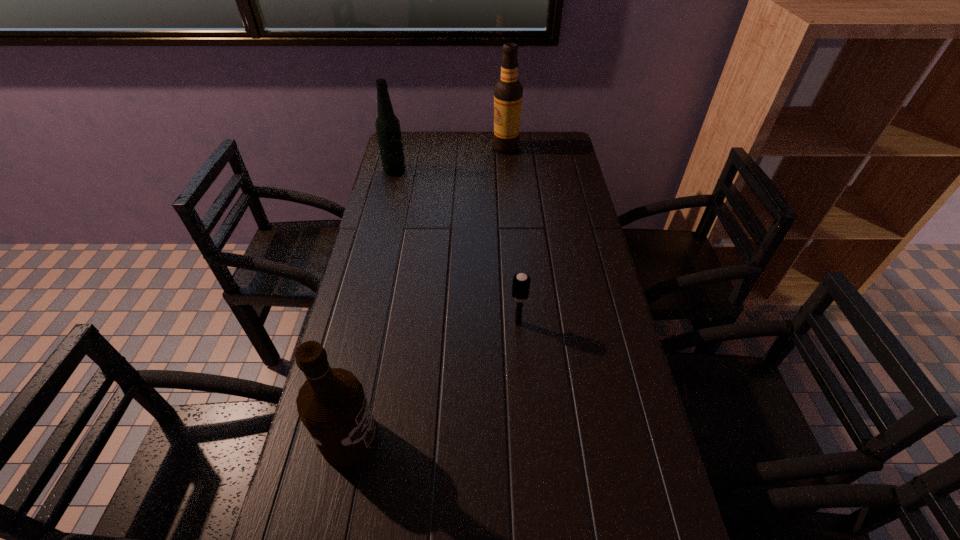
The image size is (960, 540). I want to click on the rightmost alcohol, so click(x=508, y=92).

I want to click on the farthest object, so click(x=508, y=92).

The image size is (960, 540). Find the location of `the third nearest object`. the third nearest object is located at coordinates (387, 125).

Where is `the nearest alcohol`? Image resolution: width=960 pixels, height=540 pixels. the nearest alcohol is located at coordinates (332, 405).

Where is `the shortest object`? The width and height of the screenshot is (960, 540). the shortest object is located at coordinates (521, 282).

Locate an element on the screen. This screenshot has height=540, width=960. hairbrush is located at coordinates tap(521, 282).

Locate an element on the screen. The image size is (960, 540). blank space located on the label of the farthest alcohol is located at coordinates (444, 148).

Where is `free region located on the label of the farthest alcohol`? This screenshot has height=540, width=960. free region located on the label of the farthest alcohol is located at coordinates (421, 148).

This screenshot has width=960, height=540. I want to click on vacant space located on the label of the farthest alcohol, so click(448, 148).

Where is `free space located 0.230m on the back of the third nearest object`? free space located 0.230m on the back of the third nearest object is located at coordinates pos(403,136).